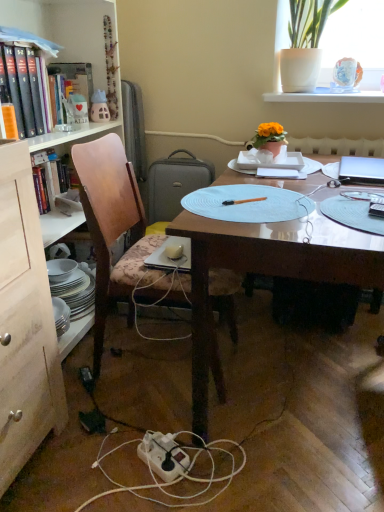
Where is `free spot to the right of white plastic power outlet at lower center`? The width and height of the screenshot is (384, 512). free spot to the right of white plastic power outlet at lower center is located at coordinates (220, 461).